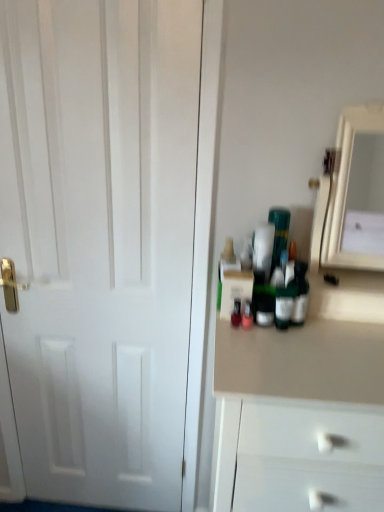
This screenshot has width=384, height=512. Identify the location of white glossy medicine cabinet at right. (353, 193).

The image size is (384, 512). What do you see at coordinates (353, 193) in the screenshot?
I see `white glossy medicine cabinet at right` at bounding box center [353, 193].

Measure the distance between point (x=170, y=430) and camera.

They are 1.50 meters apart.

This screenshot has width=384, height=512. What do you see at coordinates (100, 241) in the screenshot?
I see `white matte door at left` at bounding box center [100, 241].

Where is `white matte door at left`? white matte door at left is located at coordinates (100, 241).

You are a GUI agent. You are given a task and a screenshot of the screen. Output one action in this format:
    pyautogui.click(x=<x>, y=<y>)
    Task: Click on the white glossy medicine cabinet at right
    The height and width of the screenshot is (512, 384).
    Given the screenshot: What is the action you would take?
    pyautogui.click(x=353, y=193)

Between white glossy medicine cabinet at right and white matte door at left, which one appears on the right side from the viewer's perspective?

white glossy medicine cabinet at right.

Is white glossy medicine cabinet at right behind white matte door at left?

No.

Is point (327, 210) in front of point (42, 159)?

That is True.

From the image's perspective, which is above, white glossy medicine cabinet at right or white matte door at left?

white glossy medicine cabinet at right is shown above in the image.

From a real-world perspective, which is physically above, white glossy medicine cabinet at right or white matte door at left?

white glossy medicine cabinet at right.

Looking at their sizes, would you say white glossy medicine cabinet at right is wider or thinner than white matte door at left?

Clearly, white glossy medicine cabinet at right has more width compared to white matte door at left.

Is white glossy medicine cabinet at right taller or shorter than white matte door at left?

white glossy medicine cabinet at right is shorter than white matte door at left.

Can you confirm if white glossy medicine cabinet at right is bigger than white matte door at left?

Incorrect, white glossy medicine cabinet at right is not larger than white matte door at left.

Consider the image. Would you say white glossy medicine cabinet at right is inside or outside white matte door at left?

white glossy medicine cabinet at right is spatially situated outside white matte door at left.

Are white glossy medicine cabinet at right and white matte door at left making contact?

No, white glossy medicine cabinet at right is not next to white matte door at left.

Is white glossy medicine cabinet at right facing towards white matte door at left?

No, white glossy medicine cabinet at right does not turn towards white matte door at left.

How different are the orientations of white glossy medicine cabinet at right and white matte door at left in degrees?

1.65 degrees separate the facing orientations of white glossy medicine cabinet at right and white matte door at left.

Find the location of a particular element. The height and width of the screenshot is (512, 384). door below the white glossy medicine cabinet at right (from a real-world perspective) is located at coordinates (100, 241).

Does white matte door at left appear on the left side of white glossy medicine cabinet at right?

Correct, you'll find white matte door at left to the left of white glossy medicine cabinet at right.

Is white matte door at left in front of or behind white glossy medicine cabinet at right in the image?

Visually, white matte door at left is located behind white glossy medicine cabinet at right.

Which is less distant, (39,326) or (322,221)?

Point (39,326) is positioned farther from the camera compared to point (322,221).

From the image's perspective, does white matte door at left appear lower than white glossy medicine cabinet at right?

Indeed, from the image's perspective, white matte door at left is shown beneath white glossy medicine cabinet at right.

From a real-world perspective, is white matte door at left physically below white glossy medicine cabinet at right?

Yes, from a real-world perspective, white matte door at left is under white glossy medicine cabinet at right.

Considering the relative sizes of white matte door at left and white glossy medicine cabinet at right in the image provided, is white matte door at left wider than white glossy medicine cabinet at right?

No, white matte door at left is not wider than white glossy medicine cabinet at right.

Does white matte door at left have a lesser height compared to white glossy medicine cabinet at right?

No, white matte door at left is not shorter than white glossy medicine cabinet at right.

Which of these two, white matte door at left or white glossy medicine cabinet at right, is bigger?

white matte door at left.

Is white matte door at left outside of white glossy medicine cabinet at right?

Indeed, white matte door at left is completely outside white glossy medicine cabinet at right.

Is white matte door at left directly adjacent to white glossy medicine cabinet at right?

white matte door at left and white glossy medicine cabinet at right are not in contact.

Is white matte door at left turned away from white glossy medicine cabinet at right?

No, white matte door at left's orientation is not away from white glossy medicine cabinet at right.

Find the location of a particular element. The width and height of the screenshot is (384, 512). medicine cabinet that is above the white matte door at left (from the image's perspective) is located at coordinates (353, 193).

Find the location of `medicine cabinet above the white matte door at left (from a real-world perspective)`. medicine cabinet above the white matte door at left (from a real-world perspective) is located at coordinates (353, 193).

Image resolution: width=384 pixels, height=512 pixels. What are the coordinates of `medicine cabinet on the right side of white matte door at left` in the screenshot? It's located at coord(353,193).